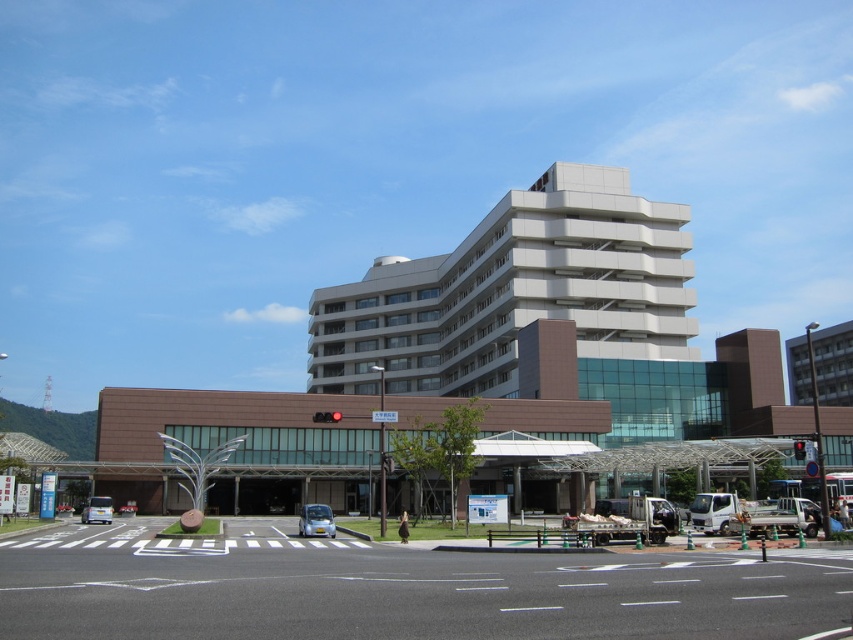
You are a delivery driver approaching the white asphalt road at lower center and the white smooth building at center. Which one is taller?

The white asphalt road at lower center is not as tall as the white smooth building at center, so the white smooth building at center is taller.

You are a pedestrian standing on the sidewalk near the pedestrian crossing. You want to cross the road to reach the sculpture in the landscaped area. Is the white asphalt road at lower center between you and the metallic blue car at center?

Yes, the white asphalt road at lower center is in front of the metallic blue car at center, meaning it is between you and the car as you stand on the sidewalk.

Based on the photo, you are a pedestrian standing at the crosswalk in front of the building. You see a metallic blue car at center and a red plastic traffic light at center right. Which object is closer to the crosswalk?

The metallic blue car at center is closer to the crosswalk than the red plastic traffic light at center right because it is positioned to the left of the traffic light, which is further to the right.